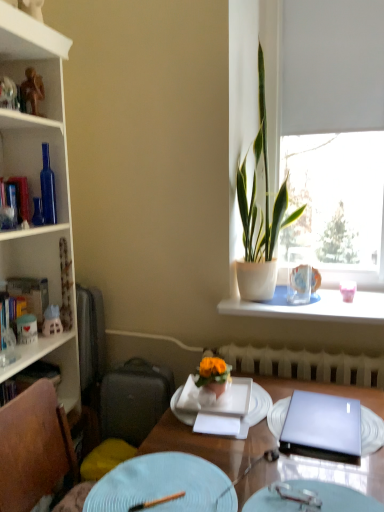
The width and height of the screenshot is (384, 512). I want to click on unoccupied space behind white paper at center, so click(226, 412).